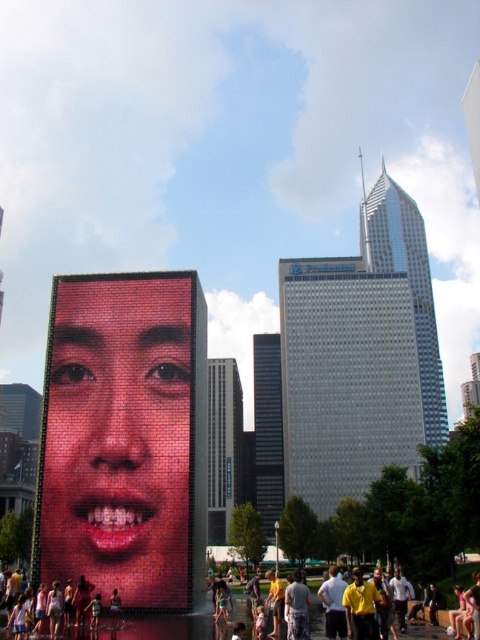
Is matte pink lips at center bigger than matte black face at center?

Actually, matte pink lips at center might be smaller than matte black face at center.

Between matte pink lips at center and matte black face at center, which one appears on the left side from the viewer's perspective?

From the viewer's perspective, matte pink lips at center appears more on the left side.

Who is more distant from viewer, (96, 522) or (239, 604)?

The point (239, 604) is more distant.

The width and height of the screenshot is (480, 640). In order to click on matte pink lips at center in this screenshot , I will do `click(113, 520)`.

This screenshot has width=480, height=640. What are the coordinates of `matte pink face at center` in the screenshot? It's located at (58, 614).

Is matte pink face at center positioned behind matte black face at center?

Yes, it is.

Measure the distance between point (96, 595) and camera.

37.49 meters

At what (x,y) coordinates should I click in order to perform the action: click on matte pink face at center. Please return your answer as a coordinate pair (x, y). Looking at the image, I should click on (58, 614).

Does point (99, 492) lie behind point (38, 625)?

Yes, it is.

Which is below, matte pink lips at center or matte pink face at center?

Positioned lower is matte pink face at center.

Which is behind, point (154, 502) or point (54, 600)?

Point (154, 502)

Identify the location of matte pink lips at center. (113, 520).